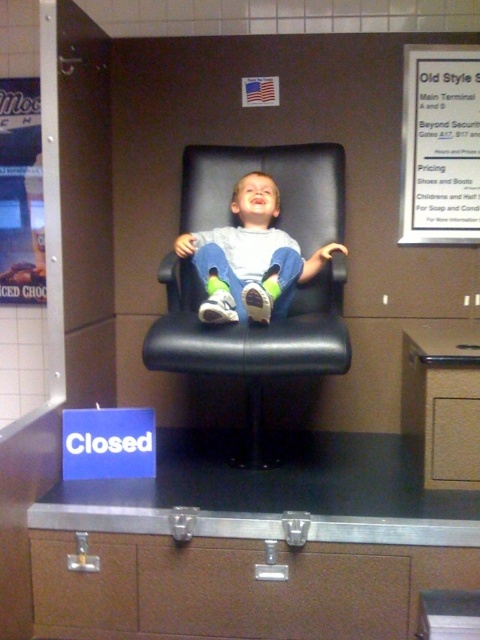
You are standing at point (x=337, y=163) and want to walk to the child in the black leather armchair. The distance between you and the child is 7.95 feet. If you can walk 3 feet per second, how many seconds will it take you to reach the child?

The distance between you and the child is 7.95 feet, and you walk at 3 feet per second. To calculate the time, divide the distance by speed. 7.95 divided by 3 equals approximately 2.65 seconds. Therefore, it will take about 2.65 seconds to reach the child.

You are a photographer trying to capture a candid shot of the child in the matte black chair at center without the white paper at upper right appearing in the frame. Is this possible based on their positions?

The white paper at upper right is further to the viewer than the matte black chair at center, so it would likely block the view of the chair from certain angles. To avoid including the white paper at upper right in the frame, the photographer would need to adjust their position so that the chair is visible without the paper obstructing it.